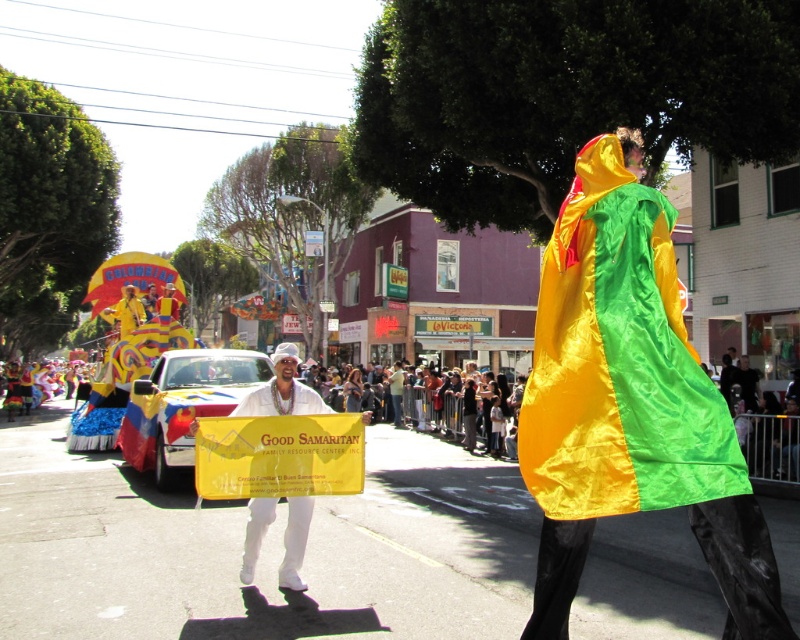
Question: Which point is closer to the camera?

Choices:
 (A) white satin banner at center
 (B) shiny satin cape at center

Answer: (B)

Question: Can you confirm if shiny satin cape at center is bigger than white satin banner at center?

Choices:
 (A) no
 (B) yes

Answer: (A)

Question: Is shiny satin cape at center further to camera compared to white satin banner at center?

Choices:
 (A) no
 (B) yes

Answer: (A)

Question: Which point is farther from the camera taking this photo?

Choices:
 (A) (541, 566)
 (B) (296, 548)

Answer: (B)

Question: Considering the relative positions of shiny satin cape at center and white satin banner at center in the image provided, where is shiny satin cape at center located with respect to white satin banner at center?

Choices:
 (A) above
 (B) below

Answer: (A)

Question: Among these objects, which one is nearest to the camera?

Choices:
 (A) white satin banner at center
 (B) shiny satin cape at center

Answer: (B)